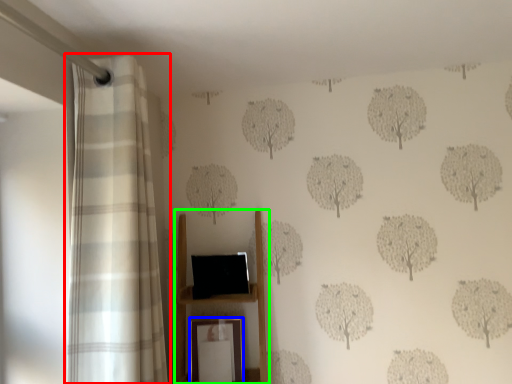
Question: Based on their relative distances, which object is nearer to curtain (highlighted by a red box)? Choose from picture frame (highlighted by a blue box) and furniture (highlighted by a green box).

Choices:
 (A) picture frame
 (B) furniture

Answer: (B)